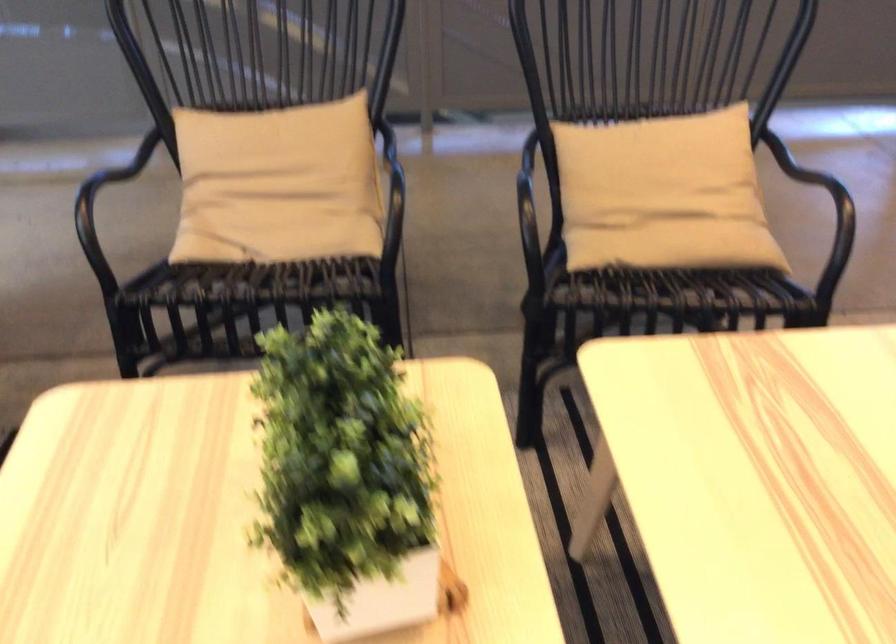
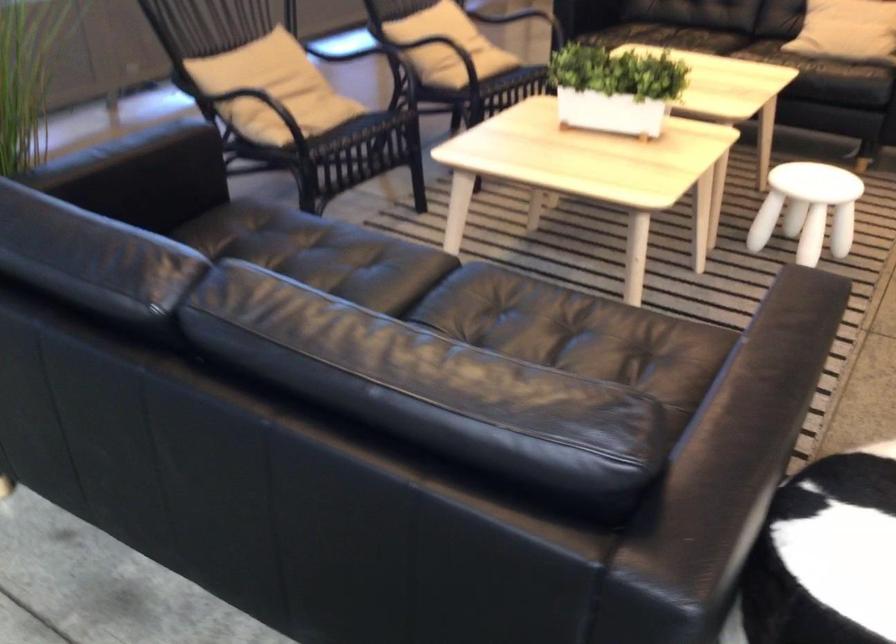
Find the pixel in the second image that matches pixel 610 181 in the first image.

(433, 43)